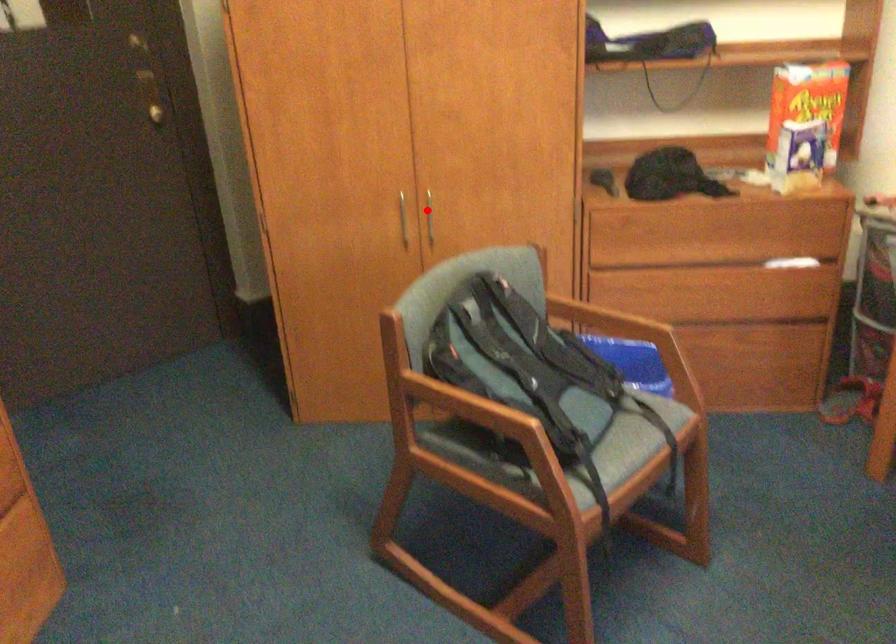
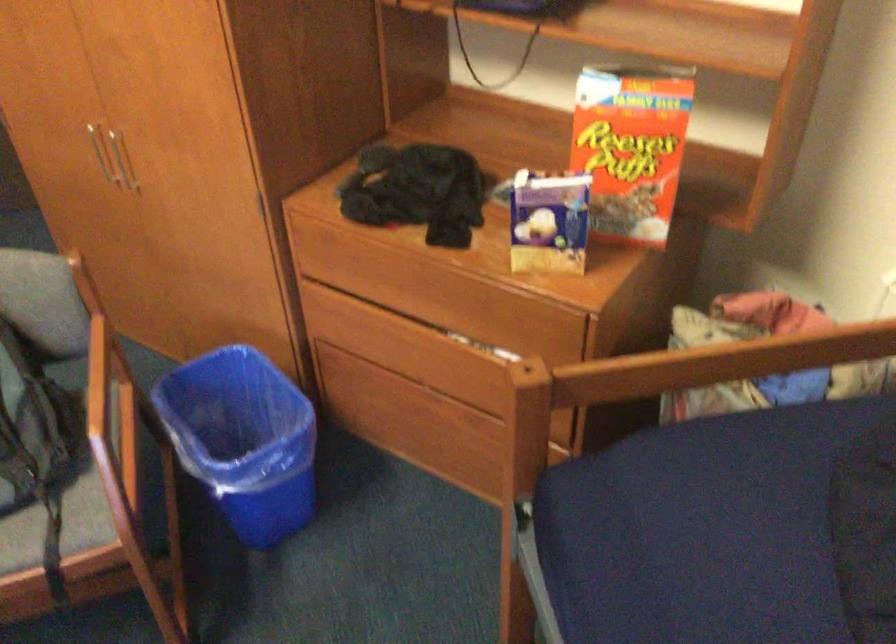
Question: A red point is marked in image1. In image2, is the corresponding 3D point closer to the camera or farther? Reply with the corresponding letter.

Choices:
 (A) The corresponding 3D point is closer.
 (B) The corresponding 3D point is farther.

Answer: (A)